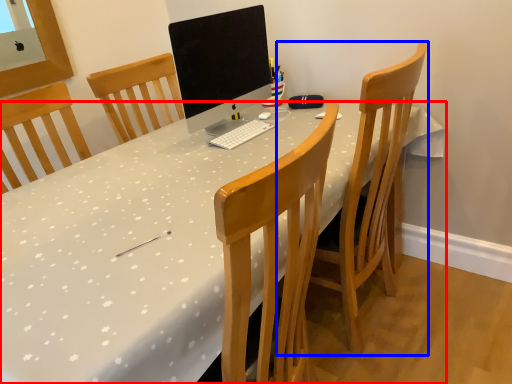
Question: Which point is closer to the camera, desk (highlighted by a red box) or chair (highlighted by a blue box)?

Choices:
 (A) desk
 (B) chair

Answer: (A)